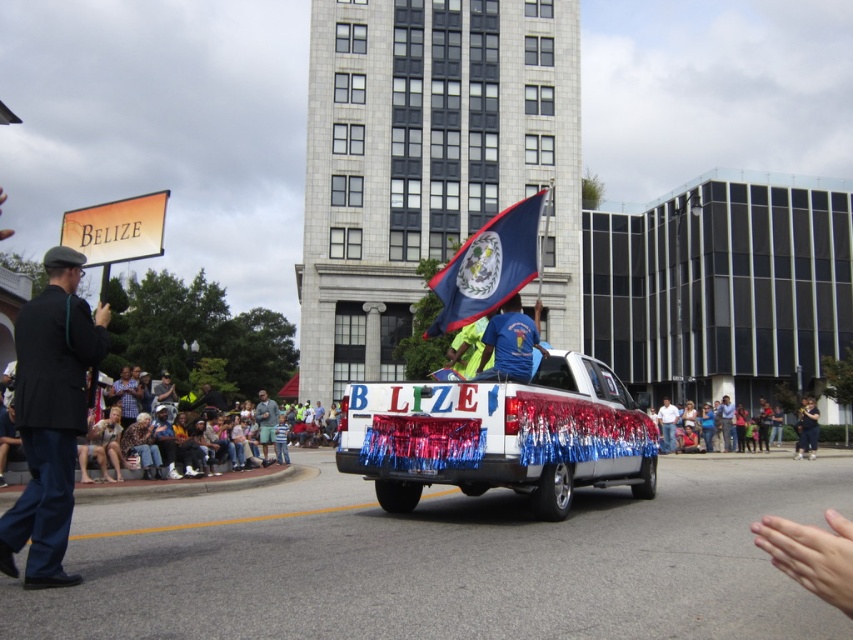
Question: Which object appears closest to the camera in this image?

Choices:
 (A) blue t-shirt at center
 (B) dark blue uniform at left
 (C) shiny metallic truck at center
 (D) checkered fabric shirt at center

Answer: (B)

Question: Can you confirm if dark blue uniform at left is thinner than dark blue denim jacket at lower right?

Choices:
 (A) yes
 (B) no

Answer: (B)

Question: Which point is closer to the camera taking this photo?

Choices:
 (A) (579, 426)
 (B) (802, 444)
 (C) (132, 404)

Answer: (A)

Question: Is shiny metallic truck at center positioned in front of dark blue uniform at left?

Choices:
 (A) yes
 (B) no

Answer: (B)

Question: Which of the following is the farthest from the observer?

Choices:
 (A) blue t-shirt at center
 (B) dark blue denim jacket at lower right
 (C) shiny metallic truck at center
 (D) light blue denim shorts at center

Answer: (B)

Question: Can you confirm if dark blue uniform at left is thinner than dark blue denim jacket at lower right?

Choices:
 (A) no
 (B) yes

Answer: (A)